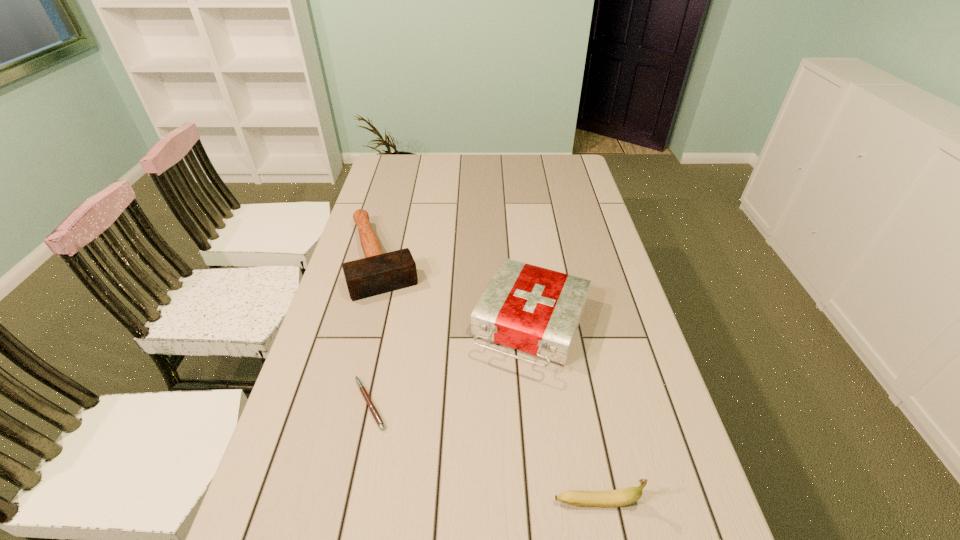
Where is `free spot on the desktop that is between the shortest object and the banana and is positioned on the striking face of the mallet`? The height and width of the screenshot is (540, 960). free spot on the desktop that is between the shortest object and the banana and is positioned on the striking face of the mallet is located at coordinates (449, 437).

Identify the location of free space on the desktop that is between the shortest object and the banana and is positioned on the front side of the first-aid kit. (476, 449).